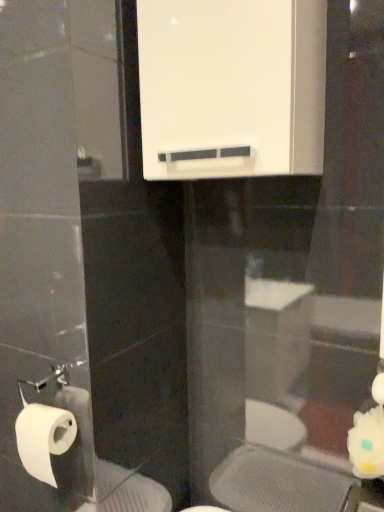
You are a GUI agent. You are given a task and a screenshot of the screen. Output one action in this format:
    pyautogui.click(x=<x>, y=<y>)
    Task: Click on the white matte toilet paper at lower left
    This screenshot has width=384, height=512.
    Given the screenshot: What is the action you would take?
    pyautogui.click(x=43, y=438)

Image resolution: width=384 pixels, height=512 pixels. What do you see at coordinates (43, 438) in the screenshot?
I see `white matte toilet paper at lower left` at bounding box center [43, 438].

What is the approximate height of white matte toilet paper at lower left?

white matte toilet paper at lower left is 5.53 inches in height.

The width and height of the screenshot is (384, 512). Find the location of `white glossy medicine cabinet at upper center`. white glossy medicine cabinet at upper center is located at coordinates (231, 87).

This screenshot has width=384, height=512. What do you see at coordinates (231, 87) in the screenshot?
I see `white glossy medicine cabinet at upper center` at bounding box center [231, 87].

At what (x,y) coordinates should I click in order to perform the action: click on white matte toilet paper at lower left. Please return your answer as a coordinate pair (x, y). Looking at the image, I should click on (43, 438).

Considering the relative positions of white glossy medicine cabinet at upper center and white matte toilet paper at lower left in the image provided, is white glossy medicine cabinet at upper center to the right of white matte toilet paper at lower left from the viewer's perspective?

Indeed, white glossy medicine cabinet at upper center is positioned on the right side of white matte toilet paper at lower left.

Considering the relative positions of white glossy medicine cabinet at upper center and white matte toilet paper at lower left in the image provided, is white glossy medicine cabinet at upper center behind white matte toilet paper at lower left?

No, white glossy medicine cabinet at upper center is closer to the camera.

Which is farther from the camera, [290,26] or [70,423]?

Point [70,423]

From the image's perspective, is white glossy medicine cabinet at upper center above or below white matte toilet paper at lower left?

Clearly, from the image's perspective, white glossy medicine cabinet at upper center is above white matte toilet paper at lower left.

From a real-world perspective, which object stands above the other?

white glossy medicine cabinet at upper center.

Which of these two, white glossy medicine cabinet at upper center or white matte toilet paper at lower left, is thinner?

With smaller width is white matte toilet paper at lower left.

Considering the sizes of objects white glossy medicine cabinet at upper center and white matte toilet paper at lower left in the image provided, who is shorter, white glossy medicine cabinet at upper center or white matte toilet paper at lower left?

white matte toilet paper at lower left is shorter.

Considering the sizes of white glossy medicine cabinet at upper center and white matte toilet paper at lower left in the image, is white glossy medicine cabinet at upper center bigger or smaller than white matte toilet paper at lower left?

Clearly, white glossy medicine cabinet at upper center is larger in size than white matte toilet paper at lower left.

Is white glossy medicine cabinet at upper center outside of white matte toilet paper at lower left?

That's correct, white glossy medicine cabinet at upper center is outside of white matte toilet paper at lower left.

Is white glossy medicine cabinet at upper center with white matte toilet paper at lower left?

white glossy medicine cabinet at upper center and white matte toilet paper at lower left are not in contact.

Is white glossy medicine cabinet at upper center turned away from white matte toilet paper at lower left?

No.

Can you tell me how much white glossy medicine cabinet at upper center and white matte toilet paper at lower left differ in facing direction?

There is a 2.02-degree angle between the facing directions of white glossy medicine cabinet at upper center and white matte toilet paper at lower left.

At what (x,y) coordinates should I click in order to perform the action: click on medicine cabinet in front of the white matte toilet paper at lower left. Please return your answer as a coordinate pair (x, y). Looking at the image, I should click on (231, 87).

Visually, is white matte toilet paper at lower left positioned to the left or to the right of white glossy medicine cabinet at upper center?

white matte toilet paper at lower left is to the left of white glossy medicine cabinet at upper center.

Between white matte toilet paper at lower left and white glossy medicine cabinet at upper center, which one is positioned in front?

white glossy medicine cabinet at upper center is more forward.

Which is behind, point (54, 448) or point (291, 81)?

Point (54, 448)

Based on the photo, from the image's perspective, is white matte toilet paper at lower left located above or below white glossy medicine cabinet at upper center?

Based on their image positions, white matte toilet paper at lower left is located beneath white glossy medicine cabinet at upper center.

From a real-world perspective, is white matte toilet paper at lower left physically below white glossy medicine cabinet at upper center?

Yes.

Considering the relative sizes of white matte toilet paper at lower left and white glossy medicine cabinet at upper center in the image provided, is white matte toilet paper at lower left thinner than white glossy medicine cabinet at upper center?

Correct, the width of white matte toilet paper at lower left is less than that of white glossy medicine cabinet at upper center.

Can you confirm if white matte toilet paper at lower left is shorter than white glossy medicine cabinet at upper center?

Indeed, white matte toilet paper at lower left has a lesser height compared to white glossy medicine cabinet at upper center.

Can you confirm if white matte toilet paper at lower left is bigger than white glossy medicine cabinet at upper center?

No, white matte toilet paper at lower left is not bigger than white glossy medicine cabinet at upper center.

Can we say white matte toilet paper at lower left lies outside white glossy medicine cabinet at upper center?

white matte toilet paper at lower left lies outside white glossy medicine cabinet at upper center's area.

Are white matte toilet paper at lower left and white glossy medicine cabinet at upper center beside each other?

white matte toilet paper at lower left and white glossy medicine cabinet at upper center are clearly separated.

Is white matte toilet paper at lower left oriented towards white glossy medicine cabinet at upper center?

No.

How different are the orientations of white matte toilet paper at lower left and white glossy medicine cabinet at upper center in degrees?

2.02 degrees separate the facing orientations of white matte toilet paper at lower left and white glossy medicine cabinet at upper center.

How distant is white matte toilet paper at lower left from white glossy medicine cabinet at upper center?

white matte toilet paper at lower left and white glossy medicine cabinet at upper center are 27.53 inches apart from each other.

Where is `toilet paper on the left of white glossy medicine cabinet at upper center`? Image resolution: width=384 pixels, height=512 pixels. toilet paper on the left of white glossy medicine cabinet at upper center is located at coordinates (43, 438).

Locate an element on the screen. The width and height of the screenshot is (384, 512). medicine cabinet located in front of the white matte toilet paper at lower left is located at coordinates (231, 87).

You are a GUI agent. You are given a task and a screenshot of the screen. Output one action in this format:
    pyautogui.click(x=<x>, y=<y>)
    Task: Click on the medicine cabinet that appears above the white matte toilet paper at lower left (from the image's perspective)
    
    Given the screenshot: What is the action you would take?
    pyautogui.click(x=231, y=87)